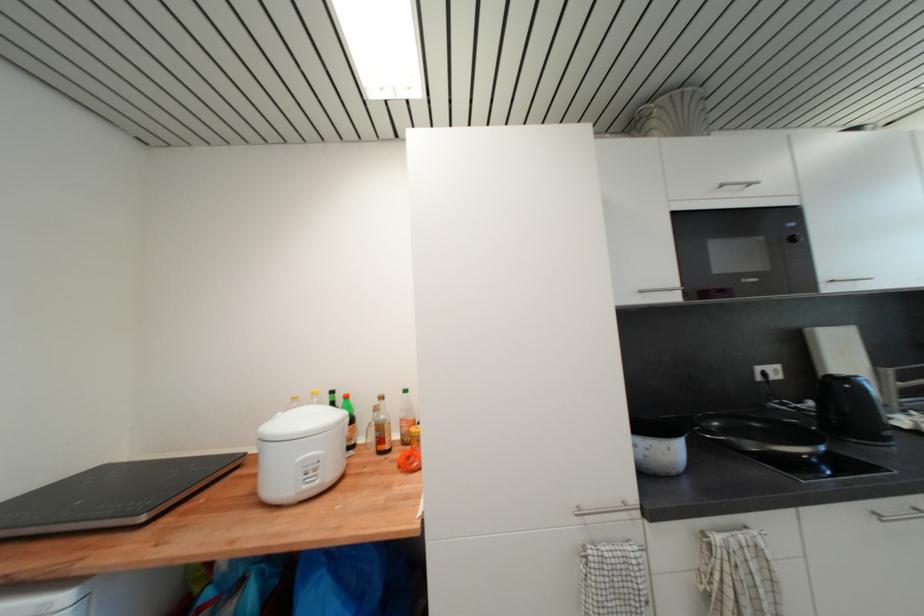
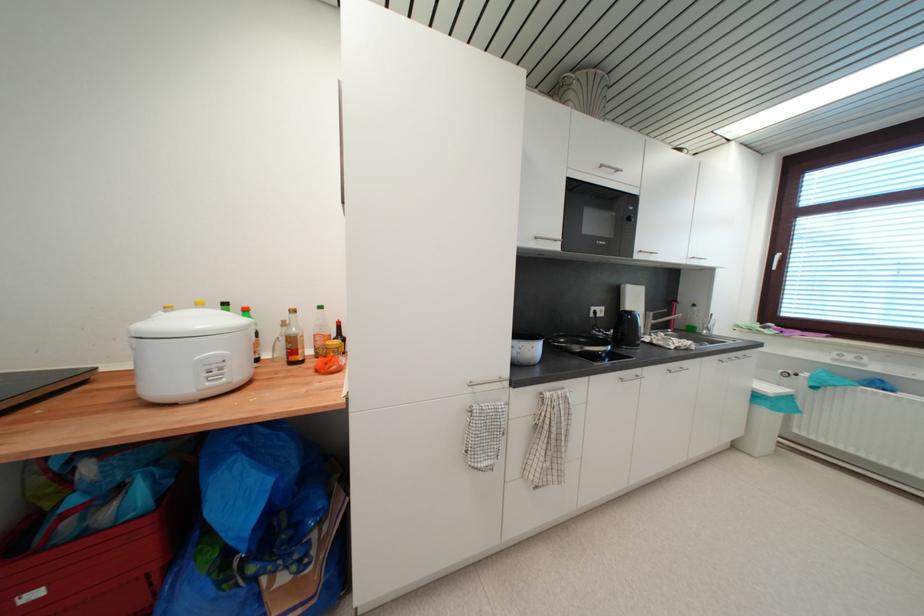
Question: The first image is from the beginning of the video and the second image is from the end. How did the camera likely rotate when shooting the video?

Choices:
 (A) Left
 (B) Right
 (C) Up
 (D) Down

Answer: (B)